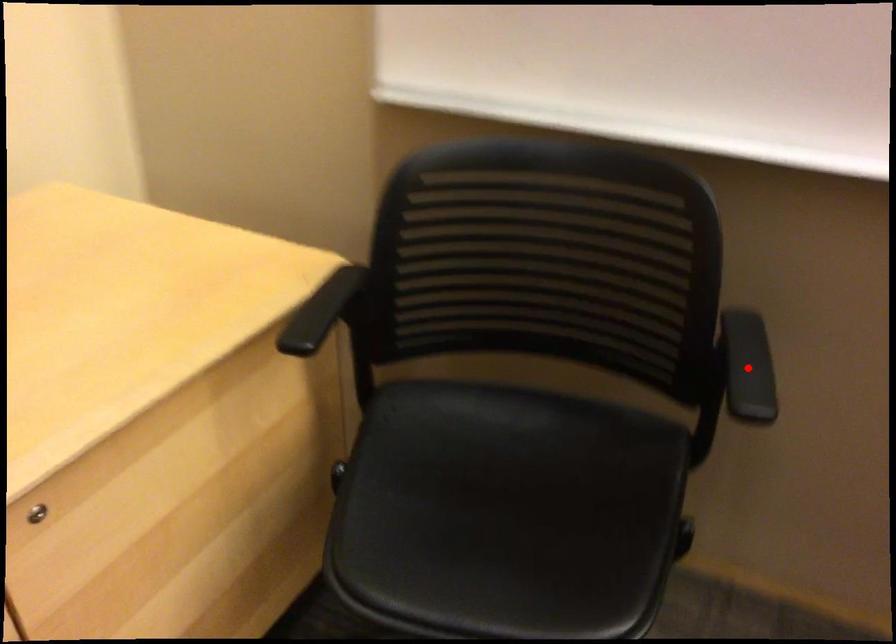
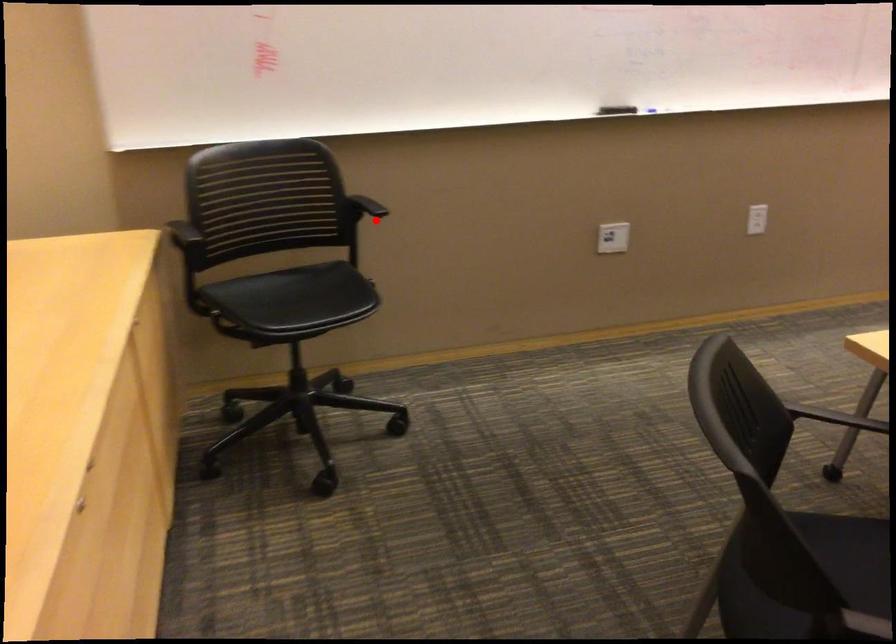
I am providing you with two images of the same scene from different viewpoints. A red point is marked on the first image and another point is marked on the second image. Is the red point in image1 aligned with the point shown in image2?

Yes